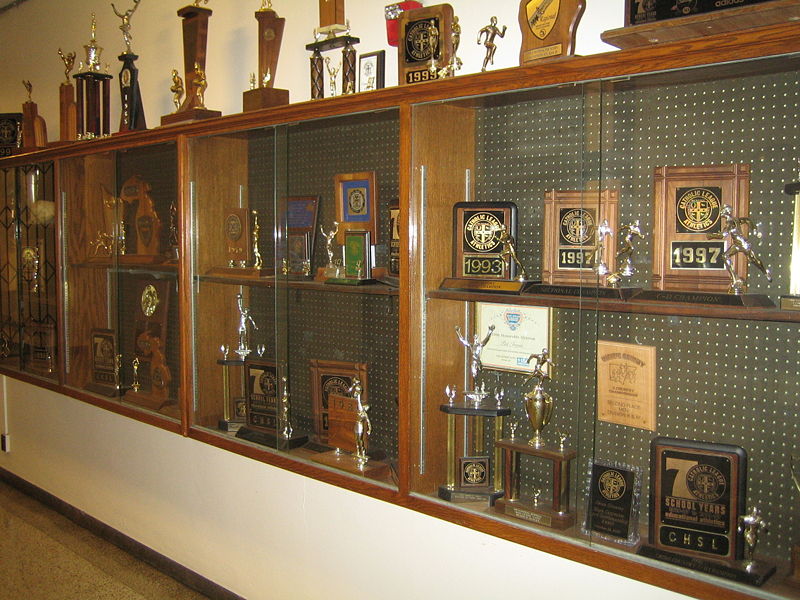
Find the location of a particular element. brown floor is located at coordinates (132, 578).